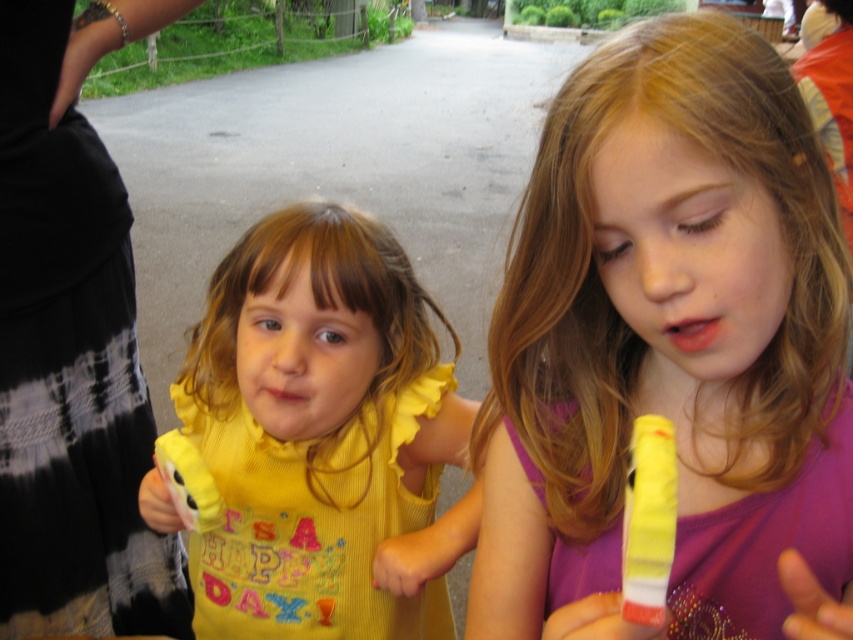
Question: Can you confirm if purple shiny dress at center is positioned to the right of yellow fabric dress at center?

Choices:
 (A) yes
 (B) no

Answer: (A)

Question: Which point is closer to the camera?

Choices:
 (A) yellow fabric dress at center
 (B) purple shiny dress at center

Answer: (B)

Question: Does yellow fabric dress at center lie behind yellow plastic toy at right?

Choices:
 (A) no
 (B) yes

Answer: (B)

Question: Which object is closer to the camera taking this photo?

Choices:
 (A) yellow fabric toy at left
 (B) yellow plastic toy at right

Answer: (B)

Question: Which point appears farthest from the camera in this image?

Choices:
 (A) (192, 483)
 (B) (322, 273)
 (C) (643, 608)
 (D) (695, 99)

Answer: (B)

Question: Does purple shiny dress at center have a lesser width compared to yellow plastic toy at right?

Choices:
 (A) no
 (B) yes

Answer: (A)